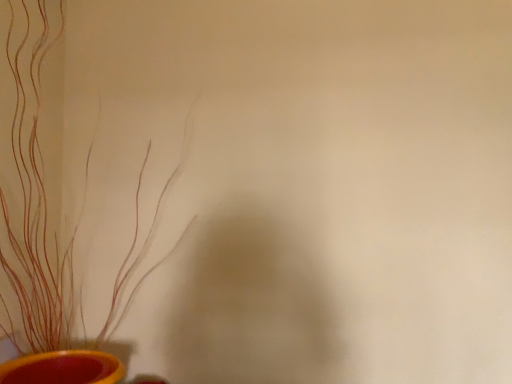
Image resolution: width=512 pixels, height=384 pixels. In order to click on matte orange vase at left in this screenshot , I will do `click(54, 250)`.

Describe the element at coordinates (54, 250) in the screenshot. I see `matte orange vase at left` at that location.

Locate an element on the screen. The height and width of the screenshot is (384, 512). matte orange vase at left is located at coordinates (54, 250).